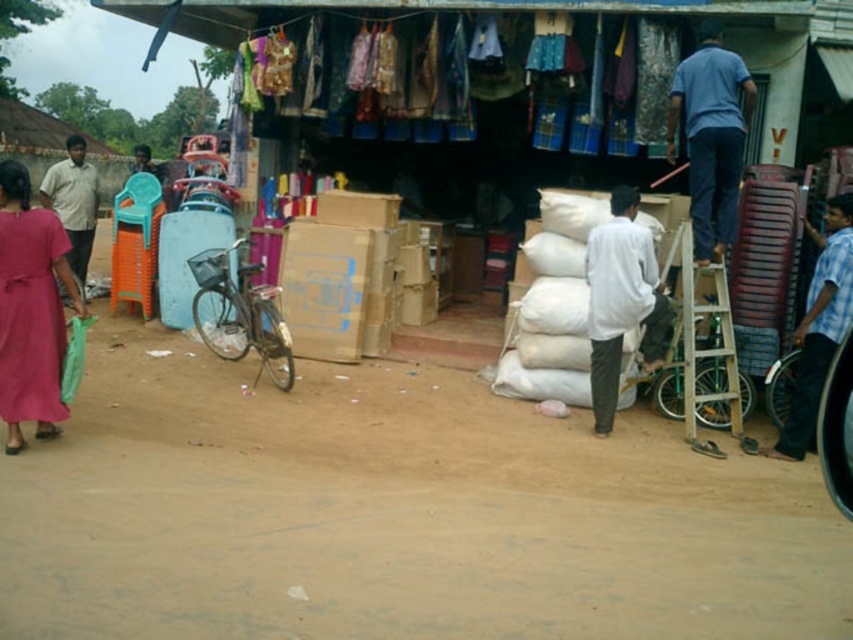
You are standing at the market and want to determine which of the two points, point [614,262] or point [827,273], is closer to you. Based on the scene description, which point is nearer?

Point [614,262] is closer to you because it is described as being further to the viewer compared to point [827,273].

You are a customer at the market and want to buy both the matte pink dress at lower left and the blue checkered shirt at right. If you can carry items up to 20 feet apart, can you pick both items without moving from your current position?

The matte pink dress at lower left and blue checkered shirt at right are 17.91 feet apart from each other, so yes, you can pick both items without moving since the distance is within your 20 feet carrying capacity.